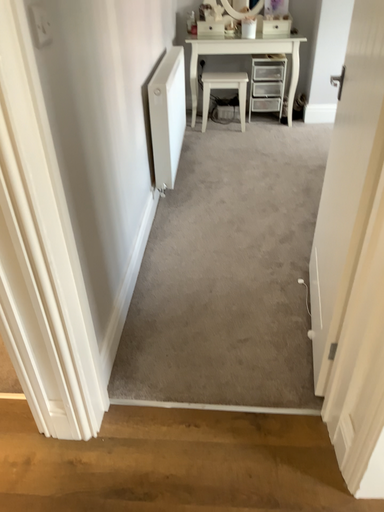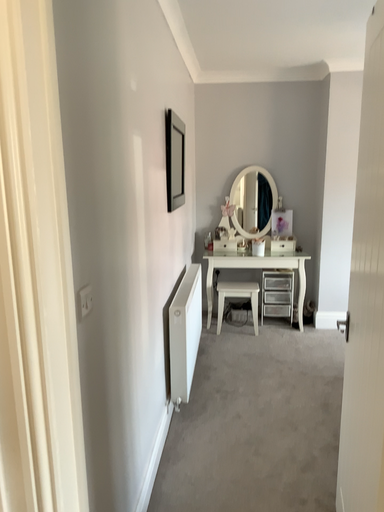
Question: Which way did the camera rotate in the video?

Choices:
 (A) rotated downward
 (B) rotated upward

Answer: (B)